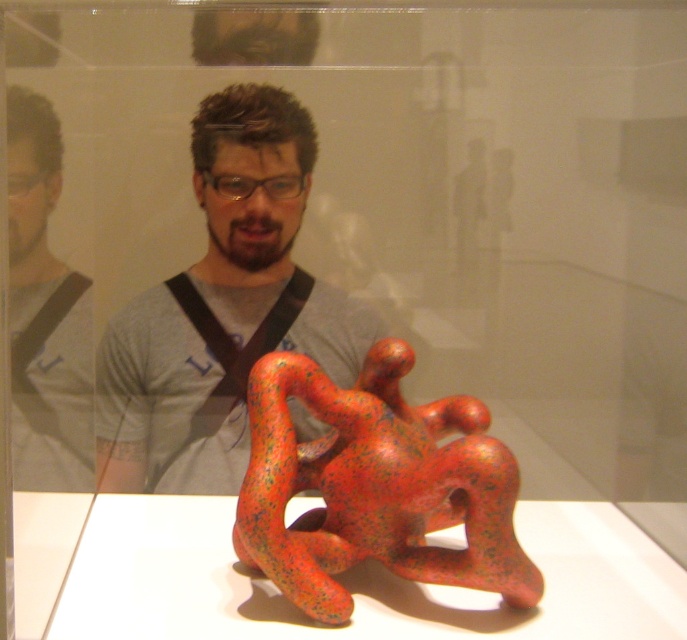
Who is lower down, matte gray shirt at center or speckled red sculpture at center?

speckled red sculpture at center is below.

The image size is (687, 640). Find the location of `matte gray shirt at center`. matte gray shirt at center is located at coordinates (223, 308).

Does speckled red sculpture at center appear under matte gray shirt at left?

Yes.

Which is above, speckled red sculpture at center or matte gray shirt at left?

matte gray shirt at left is above.

What are the coordinates of `speckled red sculpture at center` in the screenshot? It's located at (374, 486).

Is point (225, 432) more distant than point (32, 456)?

Yes, it is behind point (32, 456).

Is point (157, 461) in front of point (69, 385)?

No, (157, 461) is further to viewer.

I want to click on matte gray shirt at center, so click(x=223, y=308).

Find the location of a particular element. This screenshot has width=687, height=640. matte gray shirt at center is located at coordinates (223, 308).